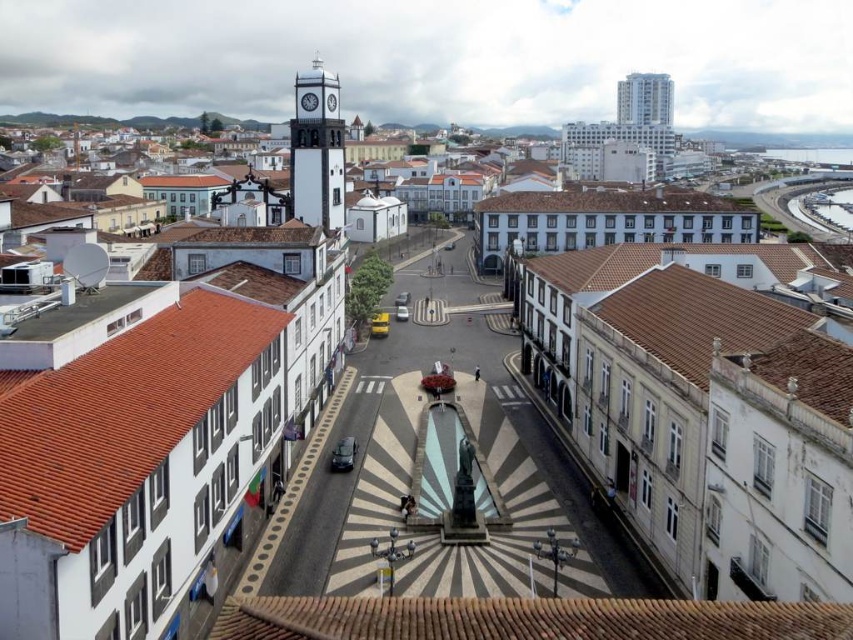
Is white painted stone clock tower at upper center closer to camera compared to white glossy clock tower at upper center?

Yes, white painted stone clock tower at upper center is closer to the viewer.

Which is more to the left, white painted stone clock tower at upper center or white glossy clock tower at upper center?

Positioned to the left is white painted stone clock tower at upper center.

Which is behind, point (300, 172) or point (329, 97)?

The point (300, 172) is more distant.

This screenshot has width=853, height=640. What are the coordinates of `white painted stone clock tower at upper center` in the screenshot? It's located at (316, 154).

Is white painted stone clock tower at upper center positioned at the back of white painted metal clock tower at upper center?

That is False.

Who is taller, white painted stone clock tower at upper center or white painted metal clock tower at upper center?

white painted stone clock tower at upper center

What do you see at coordinates (316, 154) in the screenshot? This screenshot has height=640, width=853. I see `white painted stone clock tower at upper center` at bounding box center [316, 154].

Locate an element on the screen. The height and width of the screenshot is (640, 853). white painted stone clock tower at upper center is located at coordinates (316, 154).

Is point (316, 100) closer to viewer compared to point (334, 106)?

That is True.

Describe the element at coordinates (308, 100) in the screenshot. I see `white painted metal clock tower at upper center` at that location.

Is point (305, 92) positioned before point (329, 102)?

Yes, point (305, 92) is in front of point (329, 102).

Locate an element on the screen. The height and width of the screenshot is (640, 853). white painted metal clock tower at upper center is located at coordinates (308, 100).